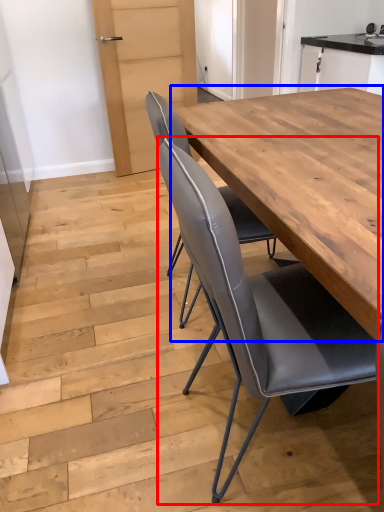
Question: Which of the following is the farthest to the observer, chair (highlighted by a red box) or table (highlighted by a blue box)?

Choices:
 (A) chair
 (B) table

Answer: (B)